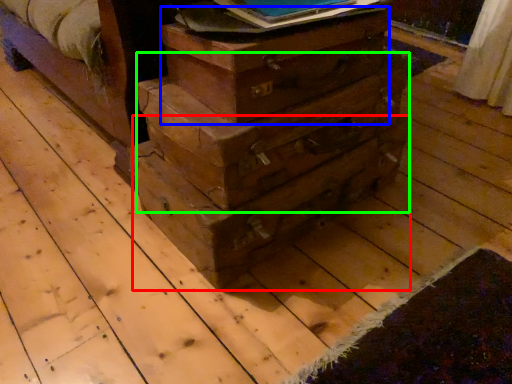
Question: Based on their relative distances, which object is nearer to drawer (highlighted by a red box)? Choose from crate (highlighted by a blue box) and drawer (highlighted by a green box).

Choices:
 (A) crate
 (B) drawer

Answer: (B)